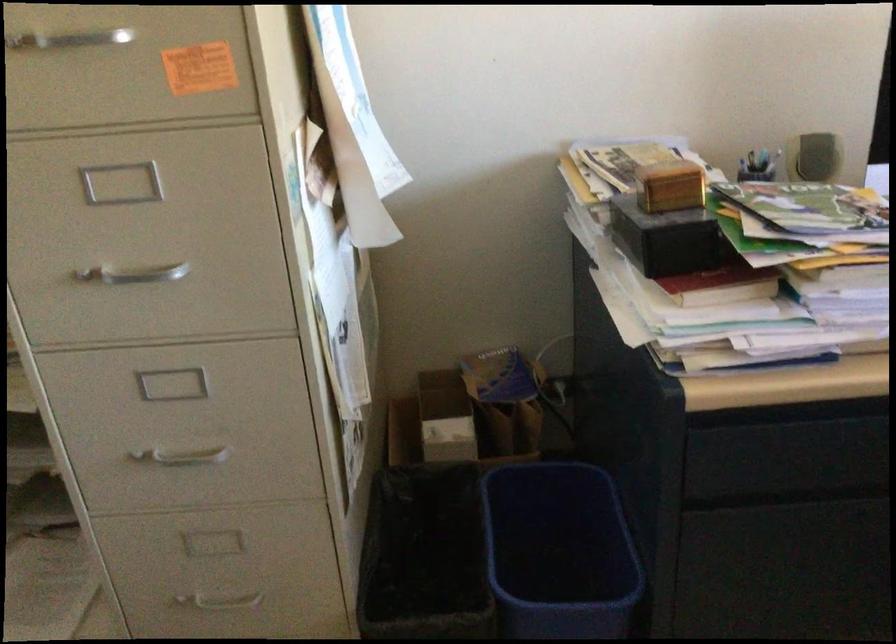
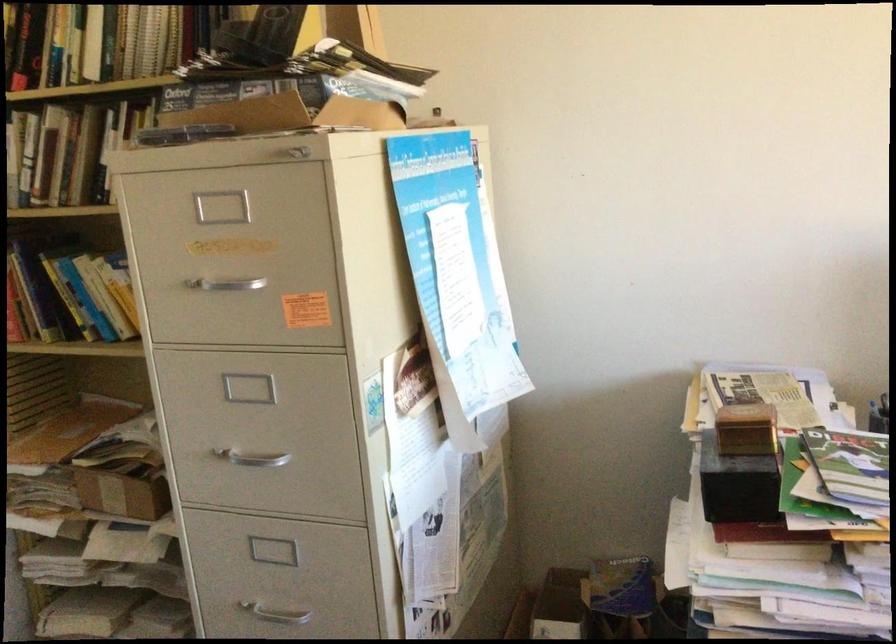
The point at (179,451) is marked in the first image. Where is the corresponding point in the second image?

(273, 608)